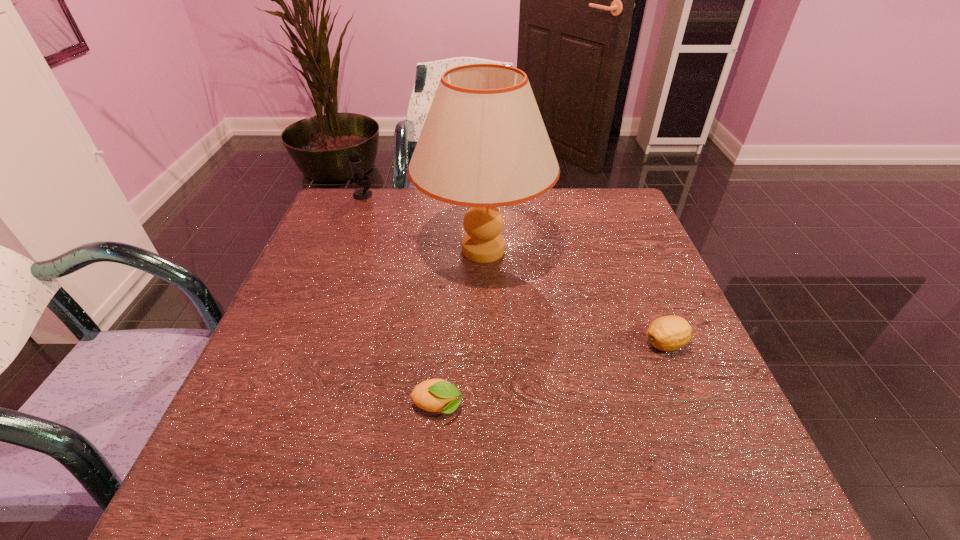
You are a GUI agent. You are given a task and a screenshot of the screen. Output one action in this format:
    pyautogui.click(x=<x>, y=<y>)
    Task: Click on the vacant space located at the stem end of the rightmost object
    The image size is (960, 540).
    Given the screenshot: What is the action you would take?
    pyautogui.click(x=497, y=344)

Identify the location of vacant region located 0.070m at the stem end of the rightmost object. (609, 344).

Locate an element on the screen. free space located 0.090m at the stem end of the rightmost object is located at coordinates (599, 344).

Find the location of a particular element. The width and height of the screenshot is (960, 540). vacant space located 0.370m with leaves positioned above the nearer lemon is located at coordinates tap(670, 407).

Where is `lampshade that is positioned at the far edge`? The height and width of the screenshot is (540, 960). lampshade that is positioned at the far edge is located at coordinates (483, 145).

This screenshot has height=540, width=960. In order to click on microphone located in the far edge section of the desktop in this screenshot , I will do `click(356, 167)`.

Identify the location of object that is at the left edge. The height and width of the screenshot is (540, 960). (356, 167).

Locate an element on the screen. object that is at the right edge is located at coordinates (667, 333).

At what (x,y) coordinates should I click in order to perform the action: click on object positioned at the far left corner. Please return your answer as a coordinate pair (x, y). This screenshot has height=540, width=960. Looking at the image, I should click on (356, 167).

Find the location of a particular element. The height and width of the screenshot is (540, 960). free location at the far edge is located at coordinates (568, 190).